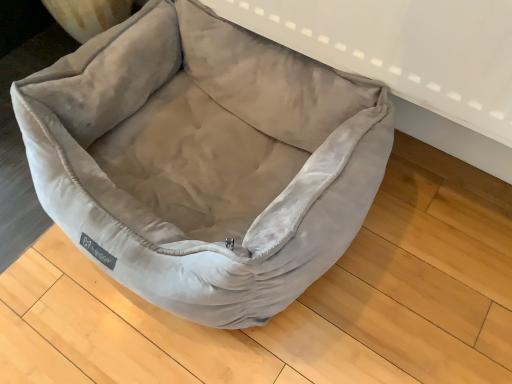
Locate an element on the screen. velvet gray dog bed at center is located at coordinates (204, 160).

The image size is (512, 384). What do you see at coordinates (204, 160) in the screenshot?
I see `velvet gray dog bed at center` at bounding box center [204, 160].

Locate an element on the screen. The width and height of the screenshot is (512, 384). velvet gray dog bed at center is located at coordinates (204, 160).